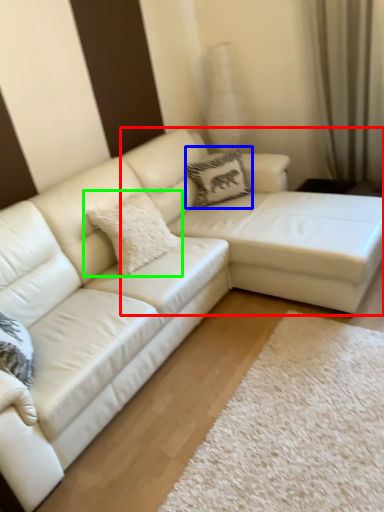
Question: Considering the real-world distances, which object is closest to couch (highlighted by a red box)? pillow (highlighted by a blue box) or pillow (highlighted by a green box).

Choices:
 (A) pillow
 (B) pillow

Answer: (A)